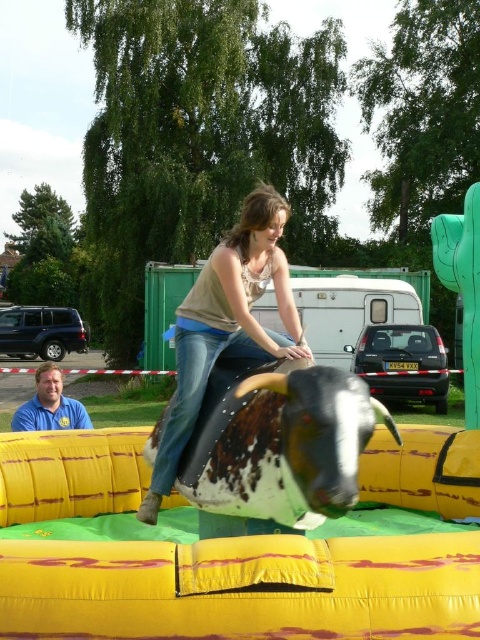
You are standing at the point marked by the coordinates (226, 324) in the image. What object are you currently standing on?

You are standing on the matte brown leather saddle at center.

You are organizing a photo shoot and need to place a small decorative item on the matte brown leather saddle at center. However, you also have a blue shirt at lower left that needs to be visible in the shot. Can the saddle accommodate the item without covering the shirt?

The matte brown leather saddle at center is smaller than the blue shirt at lower left, so placing a small decorative item on the saddle may not interfere with the visibility of the shirt as long as the item is appropriately sized and positioned.

You are a photographer positioned at the origin point of the image coordinate system. You want to capture a photo of the brown textured bull at center. According to the coordinate system, where should you aim your camera?

The brown textured bull at center is located at point (279, 442) in the 2D coordinate system, so you should aim your camera at that coordinate to capture it.